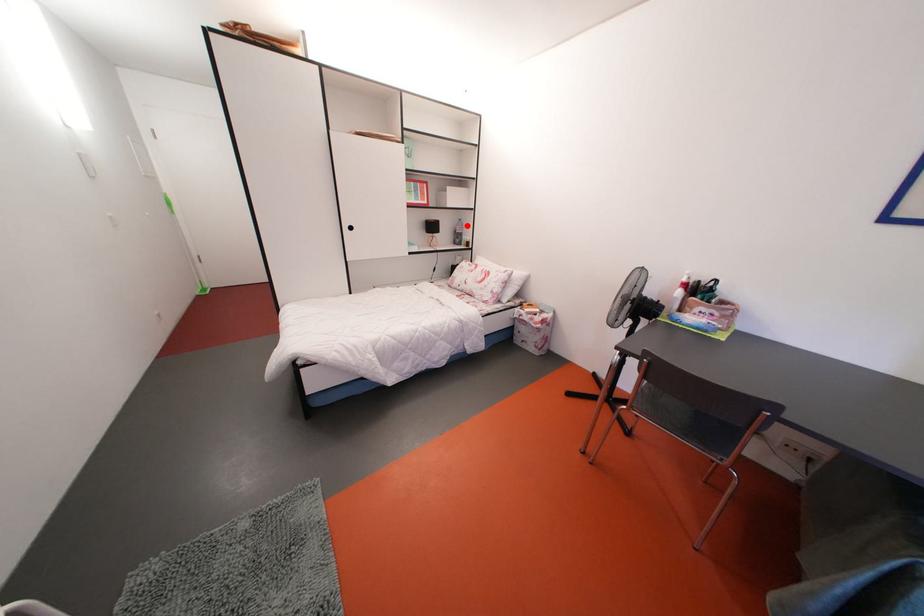
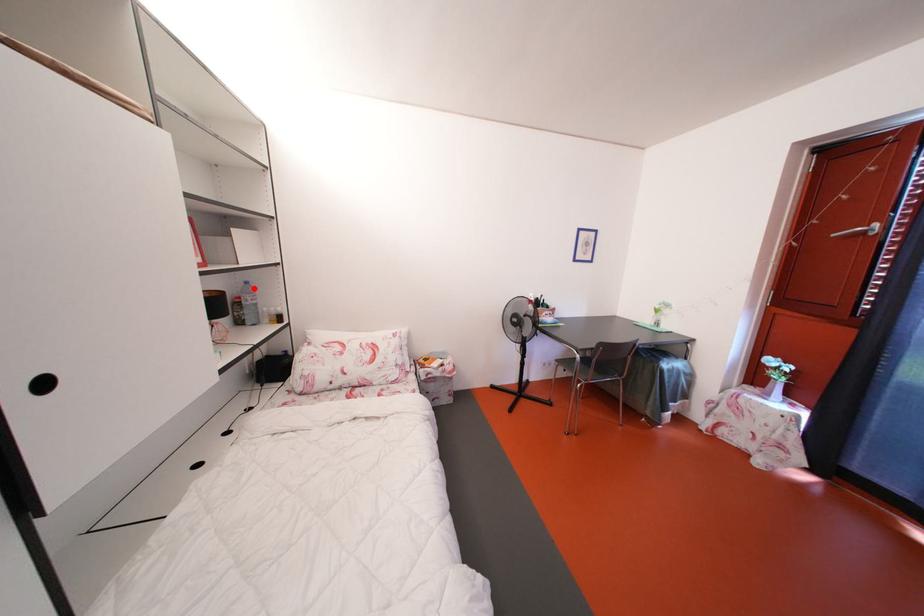
I am providing you with two images of the same scene from different viewpoints. A red point is marked on the first image and another point is marked on the second image. Is the red point in image1 aligned with the point shown in image2?

Yes